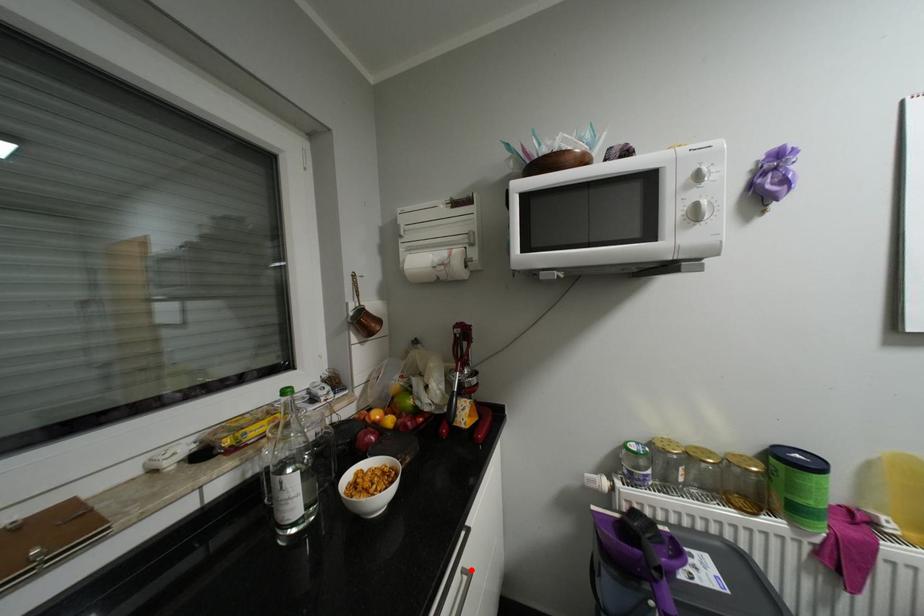
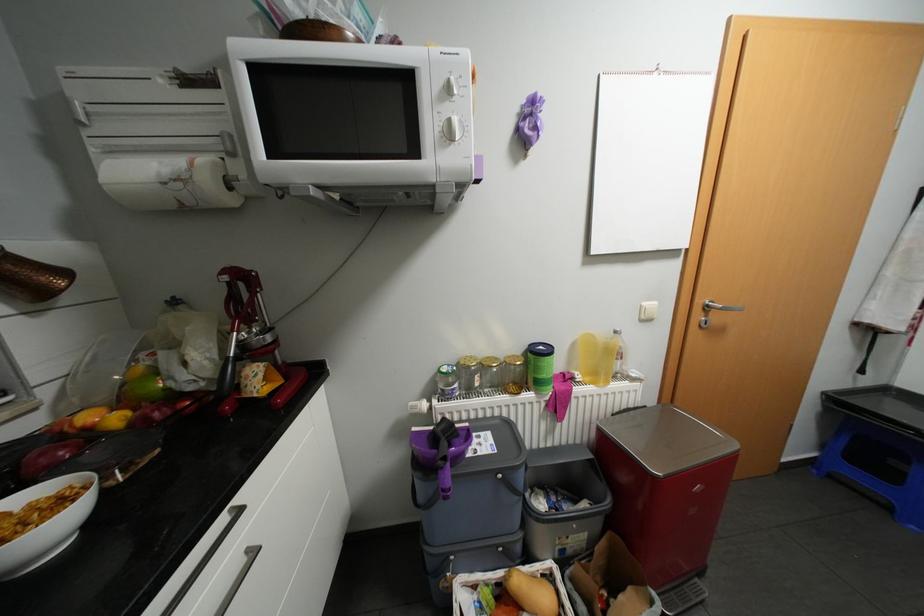
Question: I am providing you with two images of the same scene from different viewpoints. In image1, a red point is highlighted. Considering the same 3D point in image2, which of the following is correct?

Choices:
 (A) It is closer
 (B) It is farther

Answer: (A)